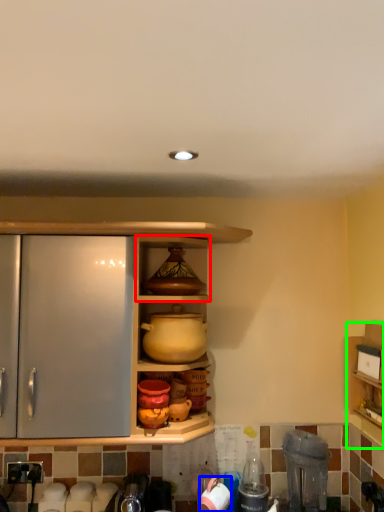
Question: Which object is the closest to the cabinet (highlighted by a red box)? Choose among these: appliance (highlighted by a blue box) or shelf (highlighted by a green box).

Choices:
 (A) appliance
 (B) shelf

Answer: (B)